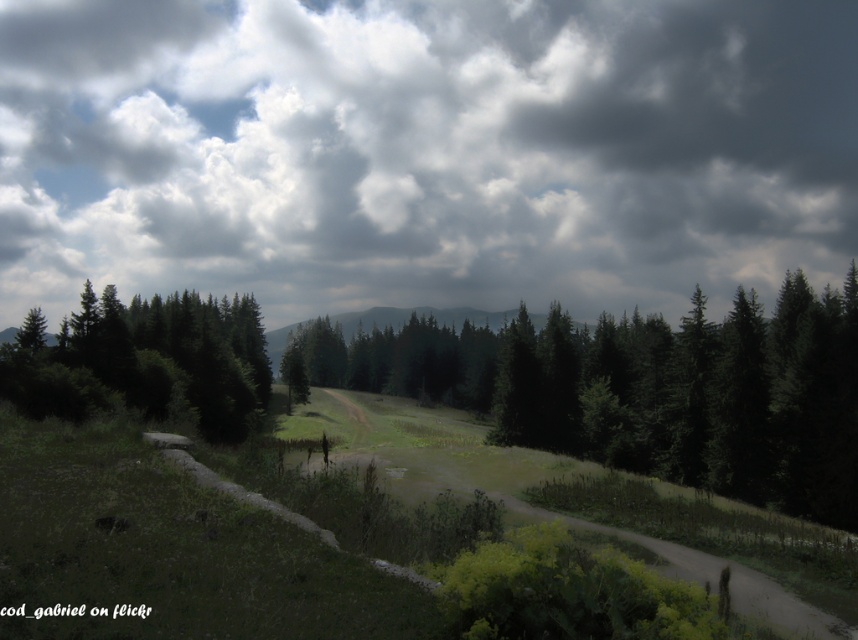
You are a hiker standing on the dirt path in the rural landscape. You notice a green matte tree at center and green matte trees at center. Which of these is closer to you?

The green matte tree at center is closer to you because it is positioned under the green matte trees at center, indicating it is in front of them.